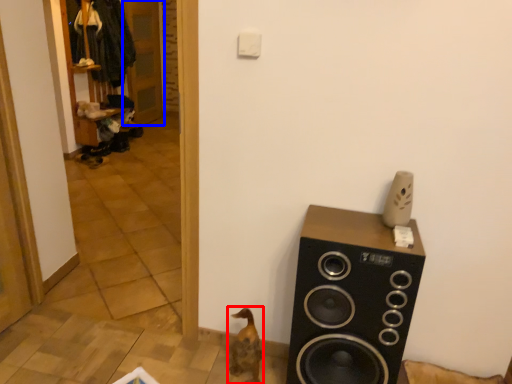
Question: Among these objects, which one is nearest to the camera, animal (highlighted by a red box) or door (highlighted by a blue box)?

Choices:
 (A) animal
 (B) door

Answer: (A)